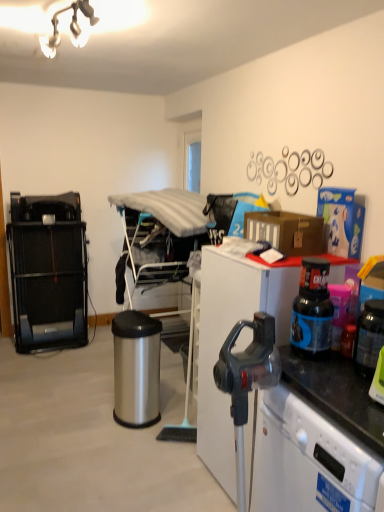
The image size is (384, 512). I want to click on free spot in front of black plastic bottle at right, so click(x=319, y=376).